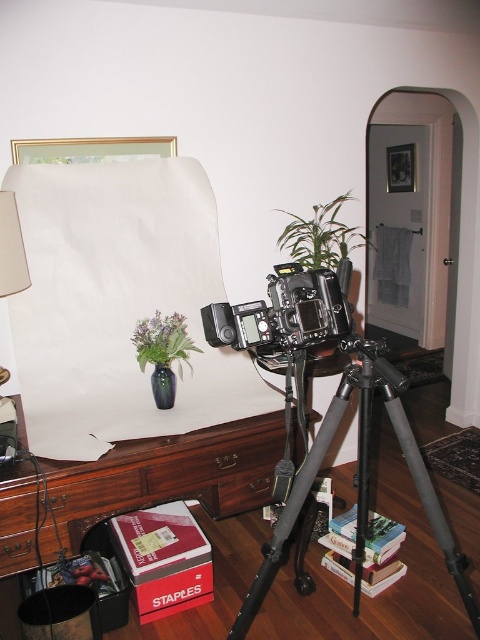
You are setting up a photography studio in your home and need to place a large equipment box that requires 2 meters of space. Given the brown wood table at center and the black metal tripod at center, which object should you move to accommodate the box?

The brown wood table at center is smaller than the black metal tripod at center, so you should move the brown wood table at center to make space for the large equipment box.

Looking at this image, you are a photographer who needs to adjust the distance between the brown wood table at center and the black metal tripod at center to 20 inches. Can you achieve this without moving the tripod?

The current distance between the brown wood table at center and the black metal tripod at center is 18.04 inches. To reach 20 inches, you would need to move the brown wood table at center away from the tripod by approximately 1.96 inches.